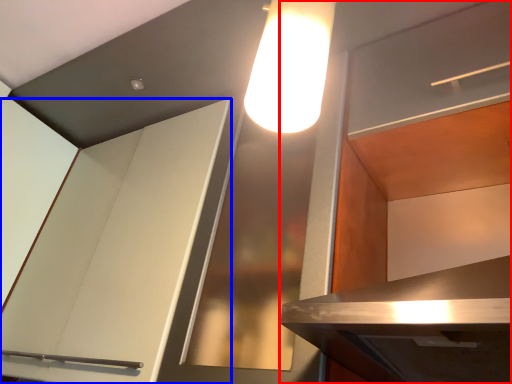
Question: Which object appears closest to the camera in this image, cabinetry (highlighted by a red box) or cabinetry (highlighted by a blue box)?

Choices:
 (A) cabinetry
 (B) cabinetry

Answer: (A)